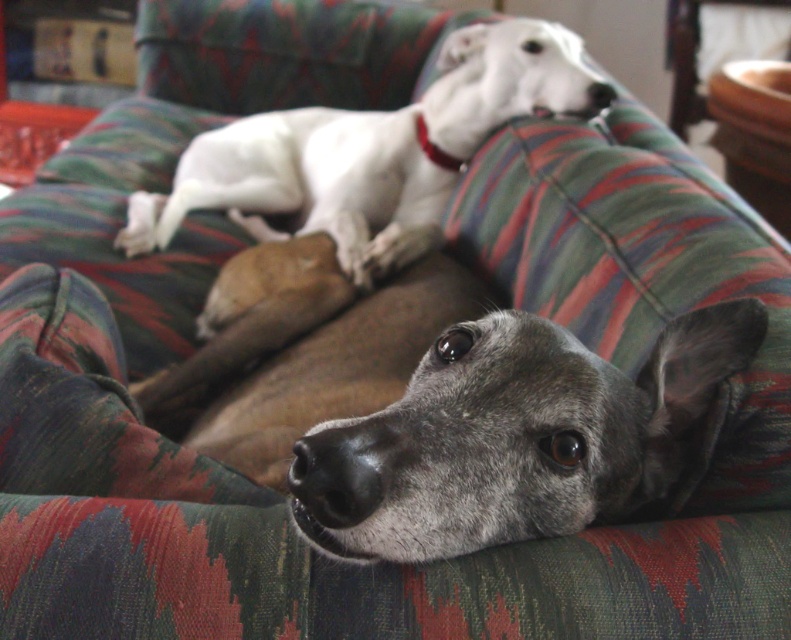
You are taking a photo of the gray fur dog at center and the red leather neckband at center. Which object will appear larger in the photo?

The gray fur dog at center will appear larger in the photo because it is closer to the viewer than the red leather neckband at center.

You are a veterinarian examining the dogs in the image. You need to determine if the red leather neckband at center is appropriate for the gray fur dog at center based on their sizes. Is the neckband too small or too big?

The gray fur dog at center has a larger size compared to the red leather neckband at center, so the neckband is too small for the gray fur dog at center.

What is the color of the fur at the point with coordinates (513, 436)?

The point with coordinates (513, 436) is on the gray fur dog at center, so the fur color there is gray.